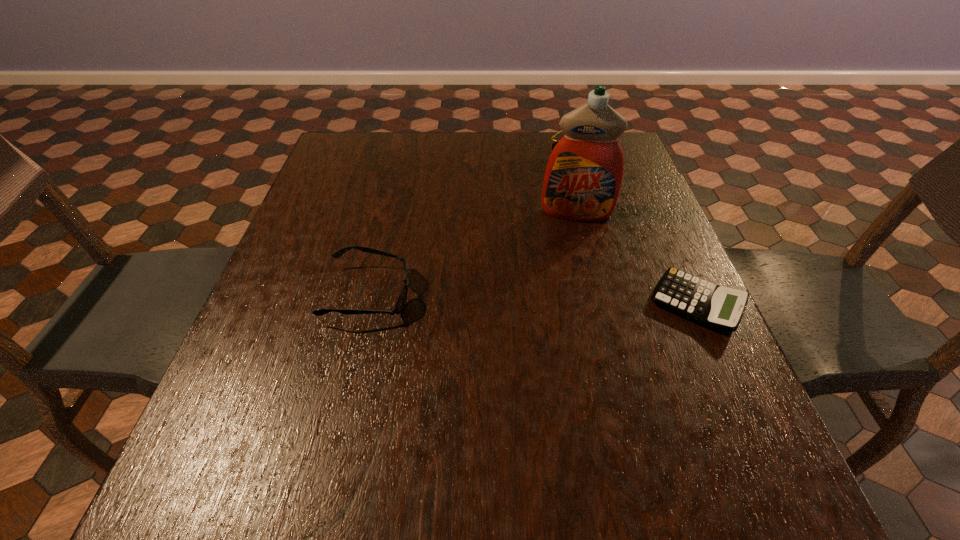
Where is `the leftmost object`? the leftmost object is located at coordinates (402, 297).

Identify the location of the nearer sunglasses. (402, 297).

Locate an element on the screen. calculator is located at coordinates (714, 306).

Find the location of a particular element. the tallest object is located at coordinates (583, 178).

You are a GUI agent. You are given a task and a screenshot of the screen. Output one action in this format:
    pyautogui.click(x=<x>, y=<y>)
    Task: Click on the second farthest object
    This screenshot has width=960, height=540.
    Given the screenshot: What is the action you would take?
    pyautogui.click(x=583, y=178)

Find the location of a particular element. The height and width of the screenshot is (540, 960). the right sunglasses is located at coordinates (553, 145).

Locate an element on the screen. The height and width of the screenshot is (540, 960). the farther sunglasses is located at coordinates (553, 145).

You are a GUI agent. You are given a task and a screenshot of the screen. Output one action in this format:
    pyautogui.click(x=<x>, y=<y>)
    Task: Click on the free spot located on the lenses of the left sunglasses
    This screenshot has width=960, height=540.
    Given the screenshot: What is the action you would take?
    pyautogui.click(x=478, y=294)

Where is `blank space located 0.240m on the back of the shortest object`? This screenshot has width=960, height=540. blank space located 0.240m on the back of the shortest object is located at coordinates (653, 206).

Locate an element on the screen. vacant region located 0.280m on the front surface of the detergent is located at coordinates (578, 310).